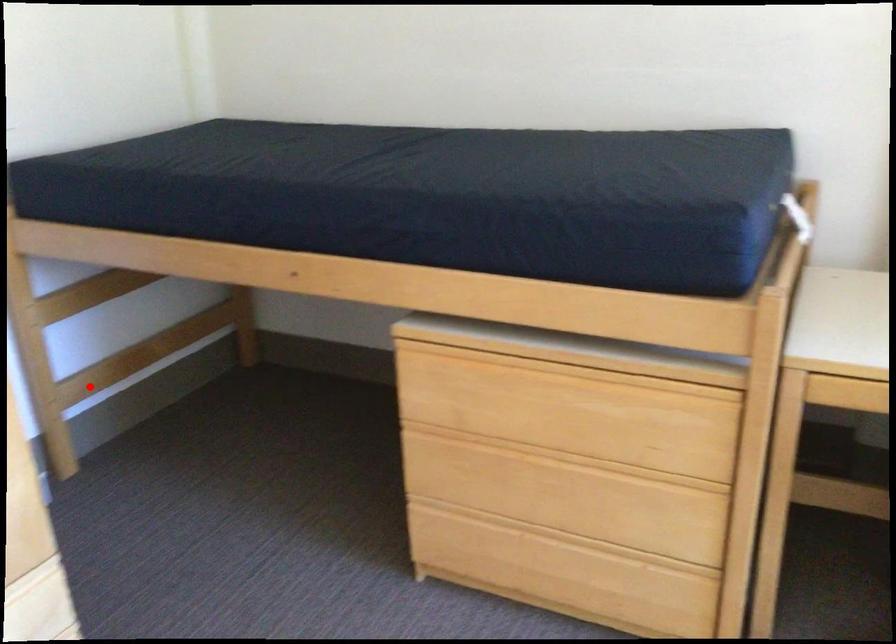
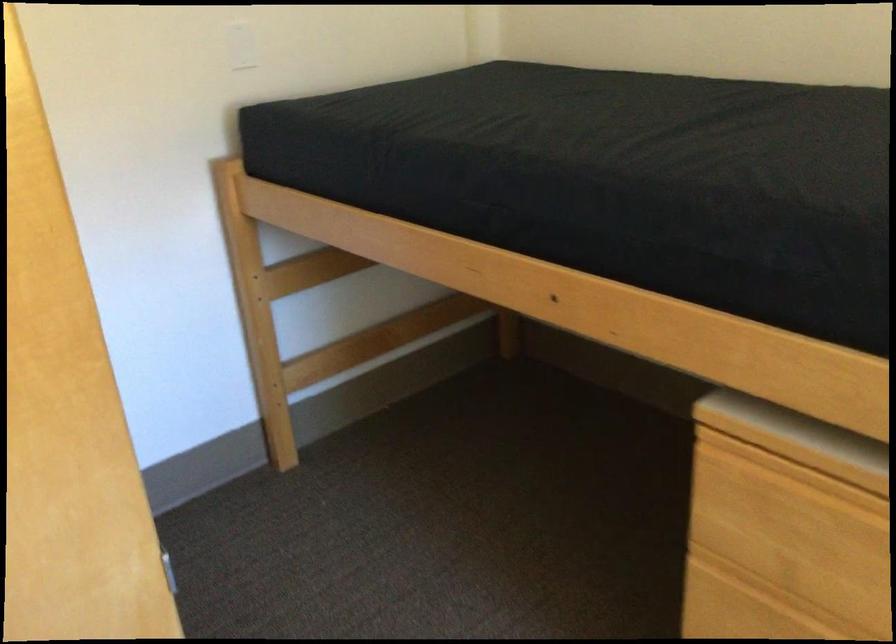
Question: A red point is marked in image1. In image2, is the corresponding 3D point closer to the camera or farther? Reply with the corresponding letter.

Choices:
 (A) The corresponding 3D point is closer.
 (B) The corresponding 3D point is farther.

Answer: (A)